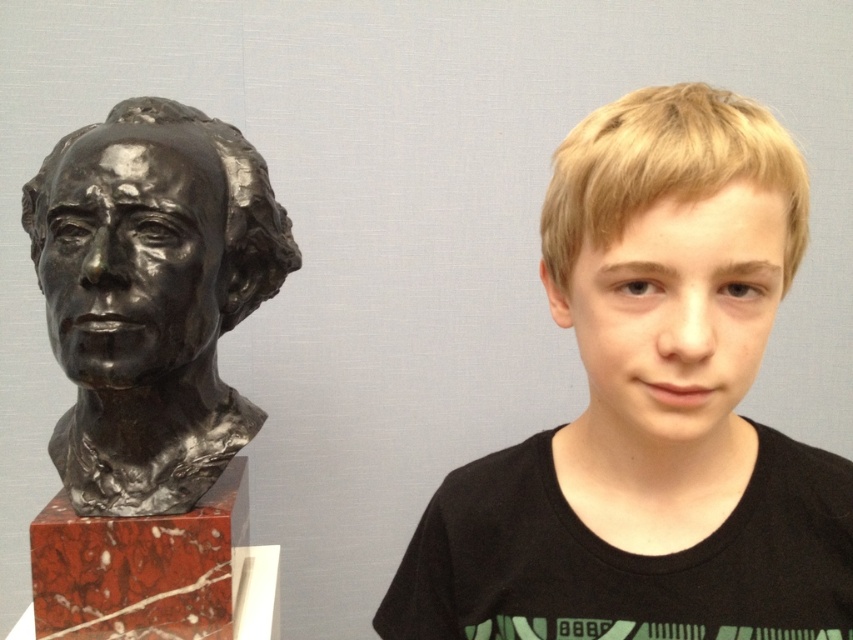
You are an interior designer arranging a gallery wall. You have the blonde hair boy at center and the bronze sculpture at left. Which object should you place closer to the center of the wall to maintain balance?

The bronze sculpture at left is wider than the blonde hair boy at center. To maintain balance, place the bronze sculpture at left closer to the center of the wall since it is larger and requires more central placement for equilibrium.

You are an art student who needs to place a 12 inch wide sculpture between the dark bust sculpture on the left and the blonde hair boy at center. Is there enough space between them to fit the sculpture?

The distance between the dark bust sculpture on the left and the blonde hair boy at center is 21.49 inches. Since the sculpture is 12 inches wide, there is enough space between them to fit the sculpture.

You are an art student analyzing the composition of the image. You notice two points marked in the scene. The first point is at coordinates point [773,296] and the second is at point [45,204]. Which point is closer to the viewer?

Point [773,296] is in front of point [45,204], so it is closer to the viewer.